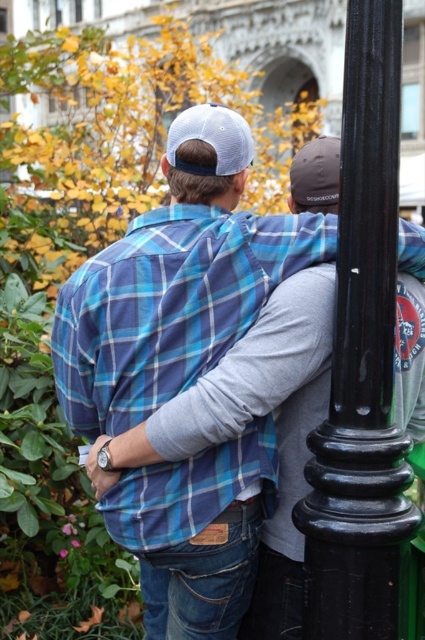
Question: Can you confirm if blue plaid shirt at center is positioned above black glossy pole at right?

Choices:
 (A) no
 (B) yes

Answer: (A)

Question: Among these objects, which one is nearest to the camera?

Choices:
 (A) blue plaid shirt at center
 (B) black glossy pole at right

Answer: (B)

Question: Can you confirm if blue plaid shirt at center is positioned above black glossy pole at right?

Choices:
 (A) yes
 (B) no

Answer: (B)

Question: Does blue plaid shirt at center lie in front of black glossy pole at right?

Choices:
 (A) yes
 (B) no

Answer: (B)

Question: Among these objects, which one is nearest to the camera?

Choices:
 (A) blue plaid shirt at center
 (B) black glossy pole at right

Answer: (B)